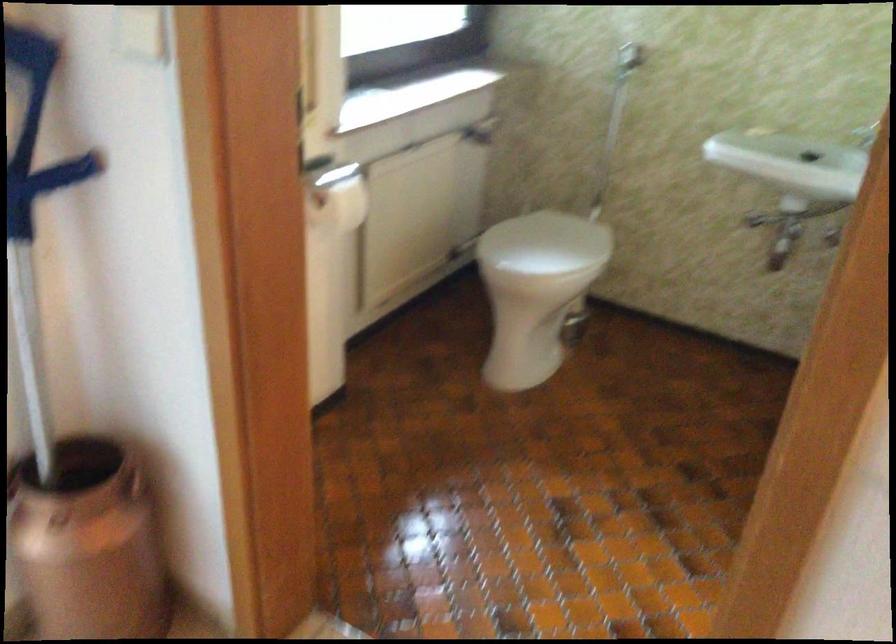
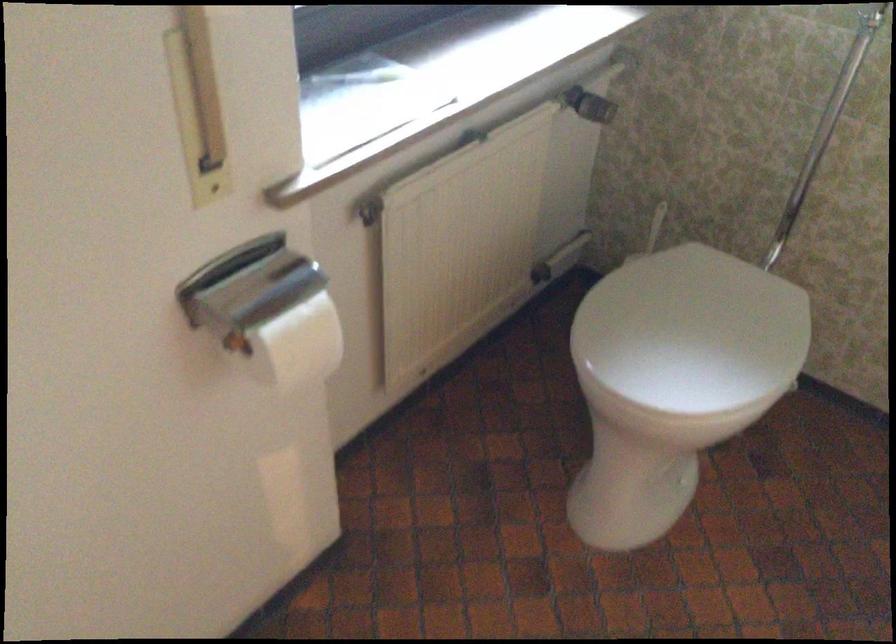
In the second image, find the point that corresponds to point 338,205 in the first image.

(298, 345)